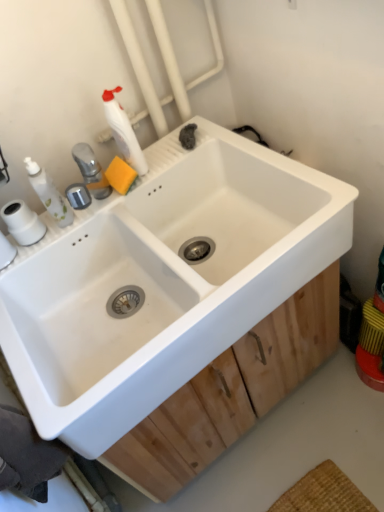
Identify the location of empty space that is ontop of wooden at center (from a real-world perspective). (294, 450).